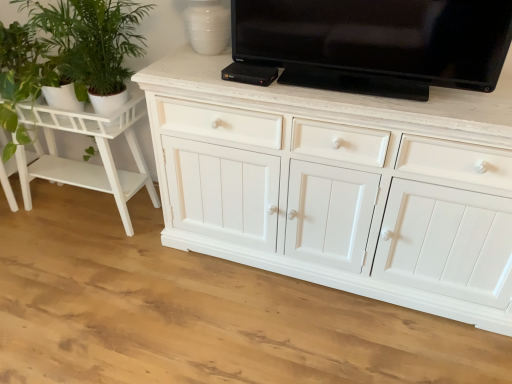
Describe the element at coordinates (91, 41) in the screenshot. I see `green leafy plant at left` at that location.

Describe the element at coordinates (87, 162) in the screenshot. The image size is (512, 384). I see `white painted wood side table at left` at that location.

Measure the distance between point [111,161] and camera.

2.08 meters.

Locate an element on the screen. This screenshot has height=384, width=512. green leafy plant at left is located at coordinates (91, 41).

Is green leafy plant at left facing away from white painted wood side table at left?

No, green leafy plant at left is not facing the opposite direction of white painted wood side table at left.

In the scene shown: How different are the orientations of green leafy plant at left and white painted wood side table at left in degrees?

green leafy plant at left and white painted wood side table at left are facing 0.973 degrees away from each other.

From the picture: Do you think green leafy plant at left is within white painted wood side table at left, or outside of it?

green leafy plant at left lies outside white painted wood side table at left.

From a real-world perspective, is green leafy plant at left physically below white painted wood side table at left?

Incorrect, from a real-world perspective, green leafy plant at left is higher than white painted wood side table at left.

How different are the orientations of green leafy plant at left and black glossy tv at upper center in degrees?

There is a 0.28-degree angle between the facing directions of green leafy plant at left and black glossy tv at upper center.

Is green leafy plant at left to the left of black glossy tv at upper center from the viewer's perspective?

Yes.

Which of these two, green leafy plant at left or black glossy tv at upper center, is smaller?

black glossy tv at upper center.

Is black glossy tv at upper center completely or partially inside green leafy plant at left?

Actually, black glossy tv at upper center is outside green leafy plant at left.

Looking at this image, from the image's perspective, which object appears higher, black glossy tv at upper center or white painted wood side table at left?

black glossy tv at upper center, from the image's perspective.

Which object is closer to the camera taking this photo, black glossy tv at upper center or white painted wood side table at left?

black glossy tv at upper center is more forward.

Based on the photo, is black glossy tv at upper center at the right side of white painted wood side table at left?

Indeed, black glossy tv at upper center is positioned on the right side of white painted wood side table at left.

Find the location of a particular element. The width and height of the screenshot is (512, 384). television lying above the white painted wood side table at left (from the image's perspective) is located at coordinates (371, 44).

From a real-world perspective, is white painted wood side table at left located higher than black glossy tv at upper center?

No, from a real-world perspective, white painted wood side table at left is not on top of black glossy tv at upper center.

Is white painted wood side table at left oriented towards black glossy tv at upper center?

No, white painted wood side table at left does not turn towards black glossy tv at upper center.

From the image's perspective, who appears lower, white painted wood side table at left or black glossy tv at upper center?

white painted wood side table at left.

Where is `television in front of the green leafy plant at left`? This screenshot has height=384, width=512. television in front of the green leafy plant at left is located at coordinates (371, 44).

Is black glossy tv at upper center directly adjacent to green leafy plant at left?

black glossy tv at upper center and green leafy plant at left are not in contact.

How many degrees apart are the facing directions of black glossy tv at upper center and green leafy plant at left?

The angle between the facing direction of black glossy tv at upper center and the facing direction of green leafy plant at left is 0.28 degrees.

Based on the photo, who is smaller, black glossy tv at upper center or green leafy plant at left?

Smaller between the two is black glossy tv at upper center.

Measure the distance between white painted wood side table at left and green leafy plant at left.

The distance of white painted wood side table at left from green leafy plant at left is 13.51 inches.

From the image's perspective, is white painted wood side table at left positioned above or below green leafy plant at left?

From the image's perspective, white painted wood side table at left appears below green leafy plant at left.

Which is more distant, (65, 130) or (113, 34)?

The point (65, 130) is more distant.

From the picture: Would you say green leafy plant at left is part of white painted wood side table at left's contents?

No, green leafy plant at left is not surrounded by white painted wood side table at left.

Where is `houseplant in front of the white painted wood side table at left`? houseplant in front of the white painted wood side table at left is located at coordinates (91, 41).

The image size is (512, 384). In order to click on television above the green leafy plant at left (from a real-world perspective) in this screenshot , I will do `click(371, 44)`.

Which object lies further to the anchor point green leafy plant at left, black glossy tv at upper center or white painted wood side table at left?

The object further to green leafy plant at left is black glossy tv at upper center.

Based on their spatial positions, is white painted wood side table at left or black glossy tv at upper center further from green leafy plant at left?

black glossy tv at upper center is positioned further to the anchor green leafy plant at left.

Based on their spatial positions, is white painted wood side table at left or green leafy plant at left closer to black glossy tv at upper center?

green leafy plant at left lies closer to black glossy tv at upper center than the other object.

Looking at the image, which one is located further to white painted wood side table at left, black glossy tv at upper center or green leafy plant at left?

black glossy tv at upper center lies further to white painted wood side table at left than the other object.

Estimate the real-world distances between objects in this image. Which object is closer to black glossy tv at upper center, green leafy plant at left or white painted wood side table at left?

Among the two, green leafy plant at left is located nearer to black glossy tv at upper center.

Which object lies further to the anchor point white painted wood side table at left, green leafy plant at left or black glossy tv at upper center?

Based on the image, black glossy tv at upper center appears to be further to white painted wood side table at left.

I want to click on houseplant between white painted wood side table at left and black glossy tv at upper center from left to right, so click(x=91, y=41).